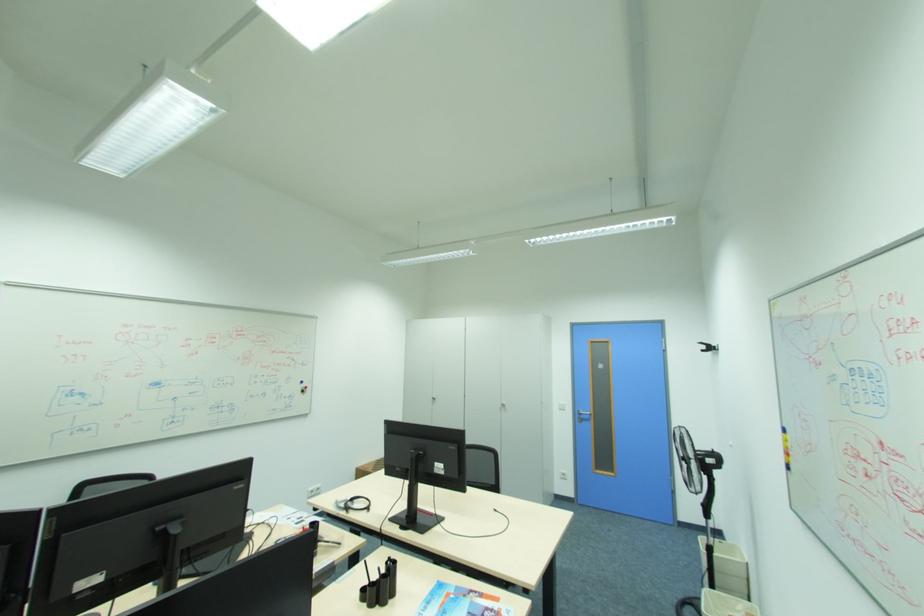
Find where to pull the silver door handle. Please return your answer as a coordinate pair (x, y).

(581, 415)